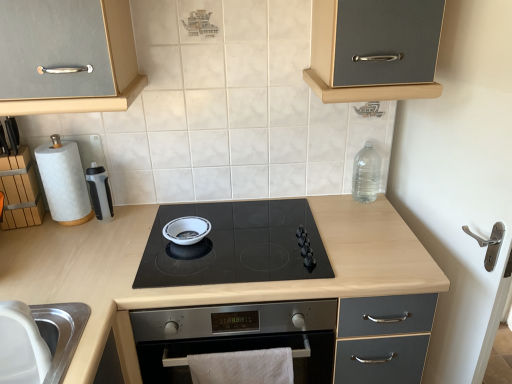
Find the location of a particular element. This screenshot has width=512, height=384. free space that is to the left of white paper towel at left is located at coordinates (32, 236).